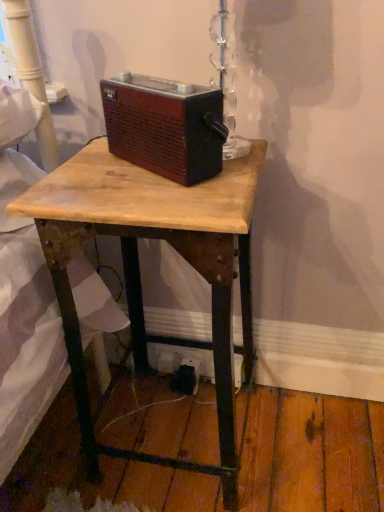
Locate an element on the screen. This screenshot has height=512, width=384. vacant area to the left of black plastic outlet at lower center is located at coordinates pos(141,399).